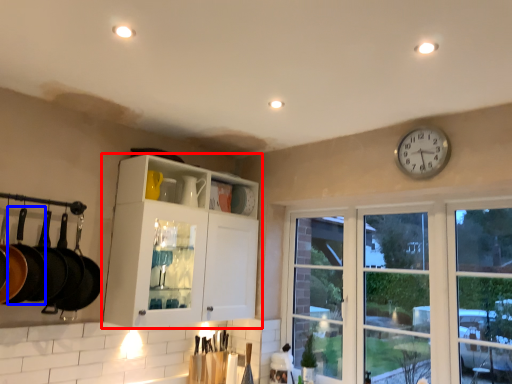
Question: Which object is further to the camera taking this photo, cabinetry (highlighted by a red box) or frying pan (highlighted by a blue box)?

Choices:
 (A) cabinetry
 (B) frying pan

Answer: (A)